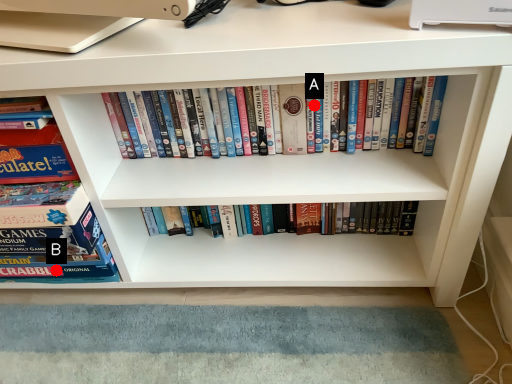
Question: Two points are circled on the image, labeled by A and B beside each circle. Among these points, which one is farthest from the camera?

Choices:
 (A) A is further
 (B) B is further

Answer: (B)